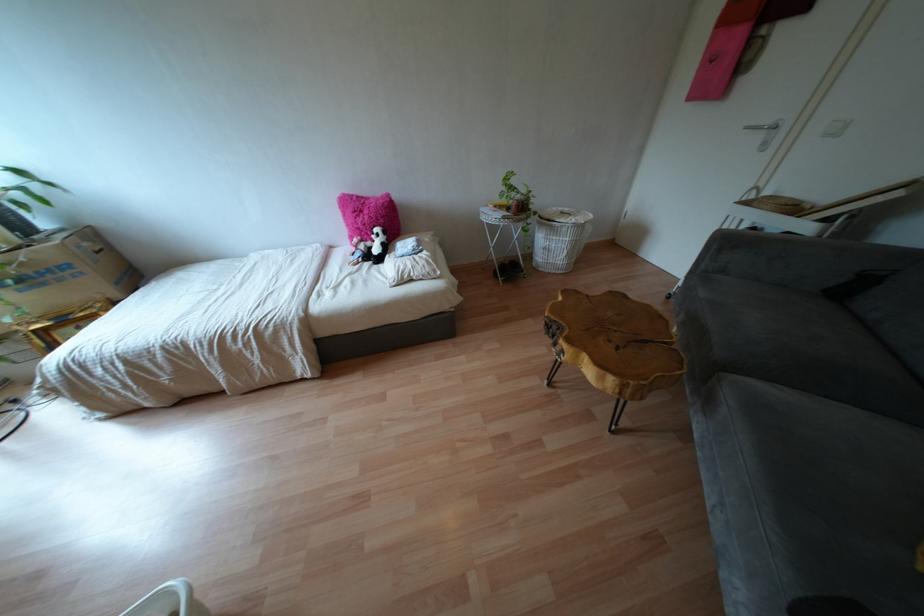
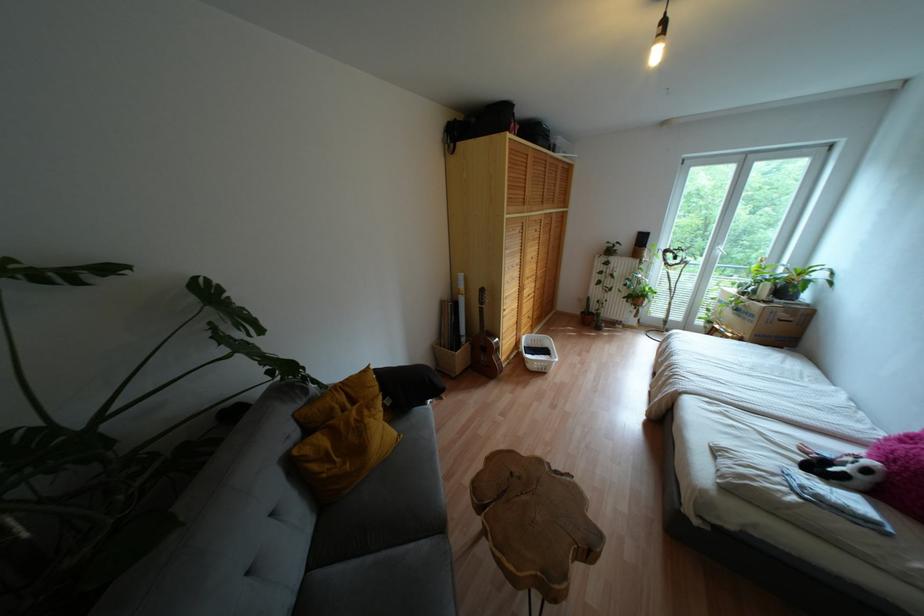
In the second image, find the point that corresponds to point 42,284 in the first image.

(737, 315)